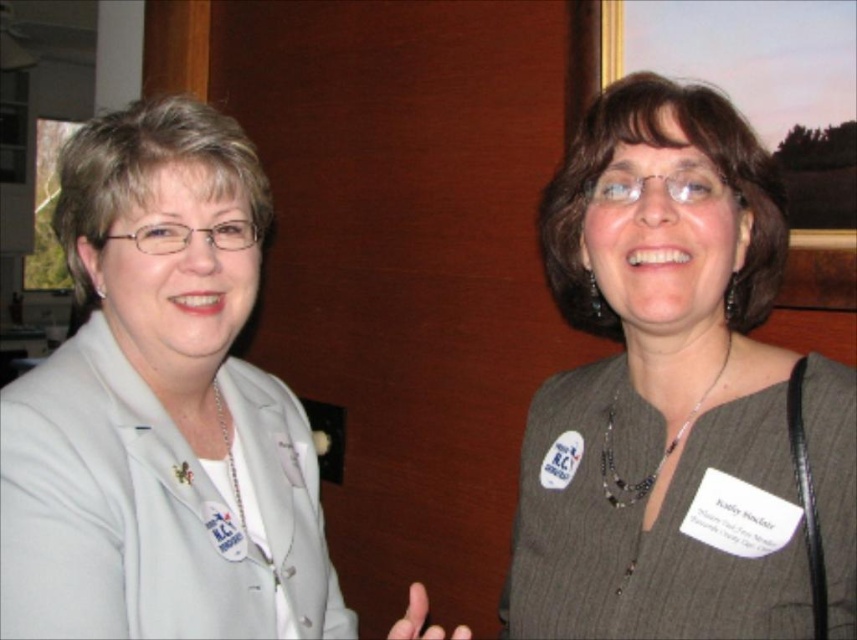
You are a photographer standing at a safe distance of 24 inches from the subject. You want to take a closeup photo of the gray textured blazer at upper right. Is the current distance sufficient?

The gray textured blazer at upper right is 25.37 inches away from the viewer. Since the photographer is standing at 24 inches, they are closer than the required distance, so the current distance is sufficient for a closeup photo.

You are taking a photo of two women in a professional setting. You notice two points in the image at coordinates point (699, 168) and point (3, 508). Which point is closer to the camera?

Point (699, 168) is further to the camera than point (3, 508), so the point closer to the camera is point (3, 508).

You are standing in a conference room and see the gray textured blazer at upper right and the white fabric at left. Which object is closer to you?

The gray textured blazer at upper right is closer to you because it is further to the viewer than the white fabric at left.